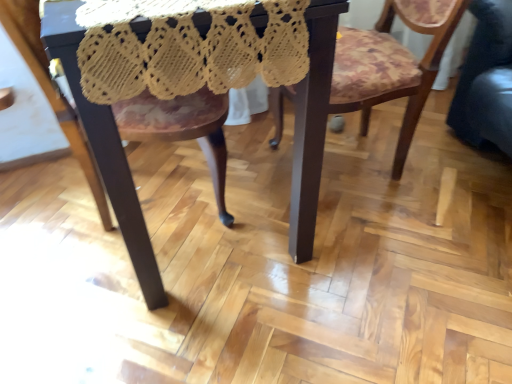
Question: Does dark brown polished wood table at center come in front of wooden chair at center, which is counted as the first chair, starting from the left?

Choices:
 (A) yes
 (B) no

Answer: (A)

Question: Considering the relative sizes of dark brown polished wood table at center and wooden chair at center, acting as the second chair starting from the right, in the image provided, is dark brown polished wood table at center thinner than wooden chair at center, acting as the second chair starting from the right,?

Choices:
 (A) no
 (B) yes

Answer: (A)

Question: Does dark brown polished wood table at center have a greater height compared to wooden chair at center, acting as the second chair starting from the right?

Choices:
 (A) no
 (B) yes

Answer: (B)

Question: Is dark brown polished wood table at center next to wooden chair at center, which is counted as the first chair, starting from the left?

Choices:
 (A) no
 (B) yes

Answer: (A)

Question: Is dark brown polished wood table at center positioned beyond the bounds of wooden chair at center, acting as the second chair starting from the right?

Choices:
 (A) no
 (B) yes

Answer: (B)

Question: From a real-world perspective, relative to dark brown polished wood table at center, is yellow crochet lace at center vertically above or below?

Choices:
 (A) above
 (B) below

Answer: (A)

Question: Looking at the image, does yellow crochet lace at center seem bigger or smaller compared to dark brown polished wood table at center?

Choices:
 (A) big
 (B) small

Answer: (B)

Question: From the image's perspective, is yellow crochet lace at center above or below dark brown polished wood table at center?

Choices:
 (A) above
 (B) below

Answer: (A)

Question: Considering their positions, is yellow crochet lace at center located in front of or behind dark brown polished wood table at center?

Choices:
 (A) behind
 (B) front

Answer: (B)

Question: Considering the positions of point (119, 107) and point (317, 54), is point (119, 107) closer or farther from the camera than point (317, 54)?

Choices:
 (A) closer
 (B) farther

Answer: (B)

Question: Looking at their shapes, would you say wooden chair at center, which is counted as the first chair, starting from the left, is wider or thinner than dark brown polished wood table at center?

Choices:
 (A) thin
 (B) wide

Answer: (A)

Question: Would you say wooden chair at center, acting as the second chair starting from the right, is to the left or to the right of dark brown polished wood table at center in the picture?

Choices:
 (A) right
 (B) left

Answer: (B)

Question: From a real-world perspective, relative to dark brown polished wood table at center, is wooden chair at center, acting as the second chair starting from the right, vertically above or below?

Choices:
 (A) above
 (B) below

Answer: (B)

Question: From a real-world perspective, relative to wooden floral-patterned chair at center, the first chair viewed from the right, is wooden chair at center, which is counted as the first chair, starting from the left, vertically above or below?

Choices:
 (A) below
 (B) above

Answer: (B)

Question: Is wooden chair at center, which is counted as the first chair, starting from the left, wider or thinner than wooden floral-patterned chair at center, acting as the second chair starting from the left?

Choices:
 (A) thin
 (B) wide

Answer: (B)